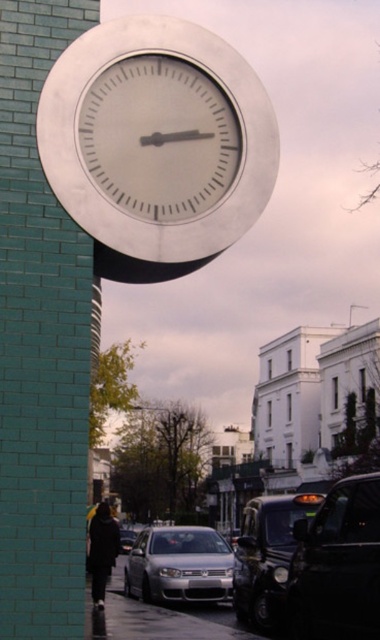
Between point (280, 532) and point (210, 545), which one is positioned in front?

Point (280, 532) is more forward.

Between point (267, 570) and point (183, 525), which one is positioned behind?

Positioned behind is point (183, 525).

You are a GUI agent. You are given a task and a screenshot of the screen. Output one action in this format:
    pyautogui.click(x=<x>, y=<y>)
    Task: Click on the shiny black car at center
    This screenshot has width=380, height=640.
    Given the screenshot: What is the action you would take?
    pyautogui.click(x=267, y=556)

Is silver metallic clock at upper center to the right of shiny black car at center from the viewer's perspective?

Incorrect, silver metallic clock at upper center is not on the right side of shiny black car at center.

From the picture: Is silver metallic clock at upper center shorter than shiny black car at center?

Yes, silver metallic clock at upper center is shorter than shiny black car at center.

In the scene shown: Measure the distance between point (185,234) and camera.

The distance of point (185,234) from camera is 6.14 meters.

Find the location of a particular element. Image resolution: width=380 pixels, height=640 pixels. silver metallic clock at upper center is located at coordinates [156, 145].

Where is `silver metallic clock at upper center`? The height and width of the screenshot is (640, 380). silver metallic clock at upper center is located at coordinates (156, 145).

Between silver metallic clock at upper center and silver metallic sedan at lower center, which one is positioned higher?

silver metallic clock at upper center

At what (x,y) coordinates should I click in order to perform the action: click on silver metallic clock at upper center. Please return your answer as a coordinate pair (x, y). Image resolution: width=380 pixels, height=640 pixels. Looking at the image, I should click on (156, 145).

Locate an element on the screen. Image resolution: width=380 pixels, height=640 pixels. silver metallic clock at upper center is located at coordinates (156, 145).